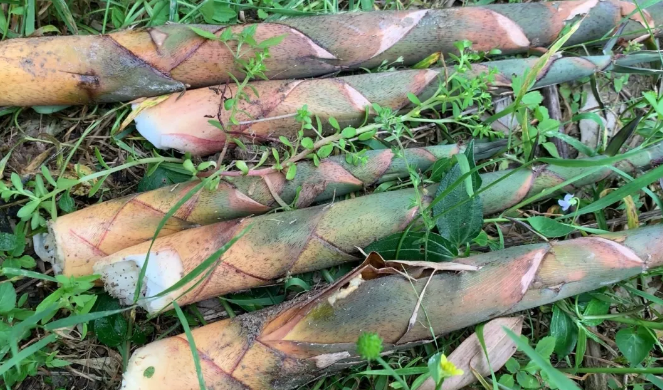
Where is `far right plant`? The image size is (663, 390). far right plant is located at coordinates (388, 313).